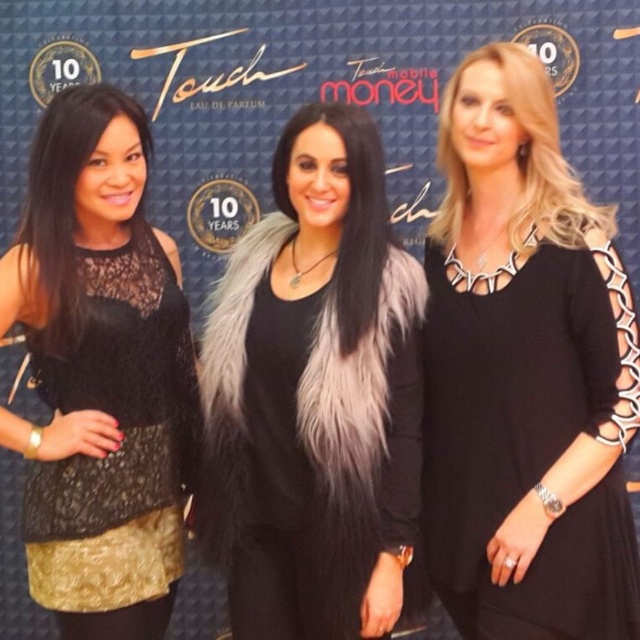
Question: Can you confirm if black matte dress at center is positioned to the right of black lace top at left?

Choices:
 (A) yes
 (B) no

Answer: (A)

Question: Which is farther from the fuzzy fur vest at center?

Choices:
 (A) black matte dress at center
 (B) black lace top at left

Answer: (B)

Question: Does fuzzy fur vest at center appear under black lace top at left?

Choices:
 (A) no
 (B) yes

Answer: (A)

Question: Which point is farther to the camera?

Choices:
 (A) fuzzy fur vest at center
 (B) black lace top at left
 (C) black matte dress at center

Answer: (B)

Question: Which of the following is the farthest from the observer?

Choices:
 (A) (6, 301)
 (B) (525, 369)

Answer: (B)

Question: Does fuzzy fur vest at center have a smaller size compared to black lace top at left?

Choices:
 (A) yes
 (B) no

Answer: (B)